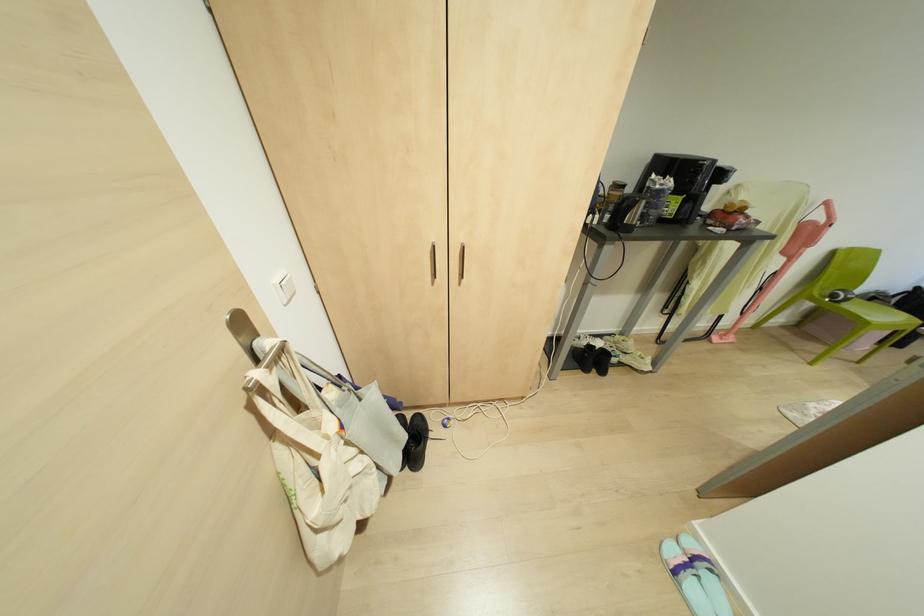
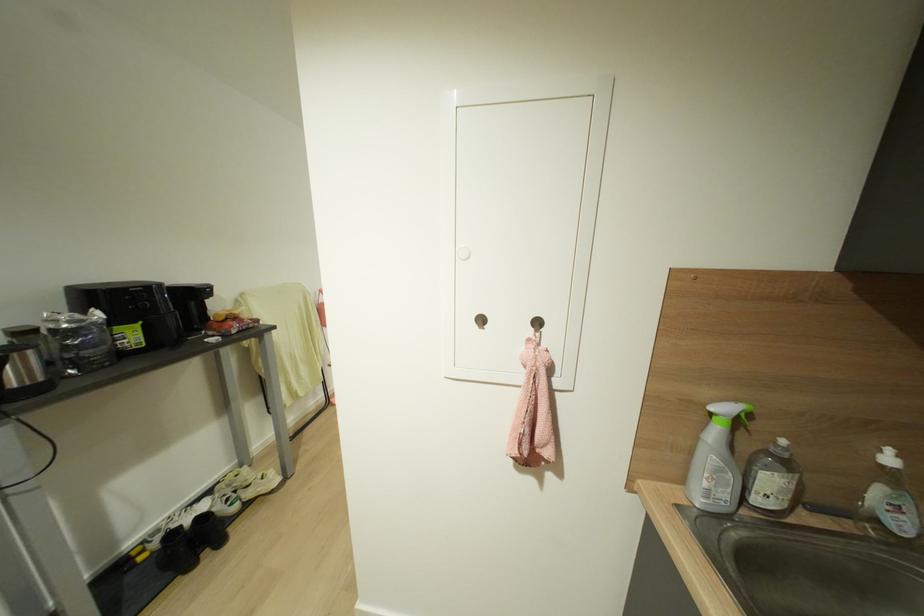
Locate, in the second image, the point that corresponds to pixel 628 228 in the first image.

(39, 389)